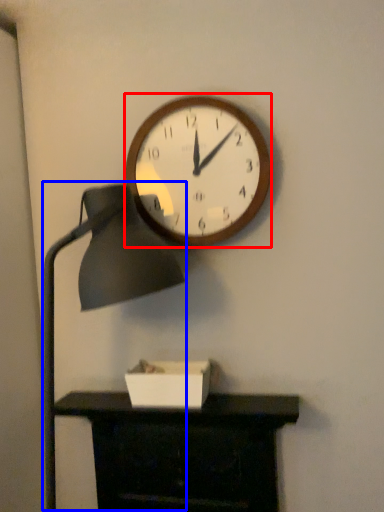
Question: Which object is closer to the camera taking this photo, wall clock (highlighted by a red box) or table lamp (highlighted by a blue box)?

Choices:
 (A) wall clock
 (B) table lamp

Answer: (B)